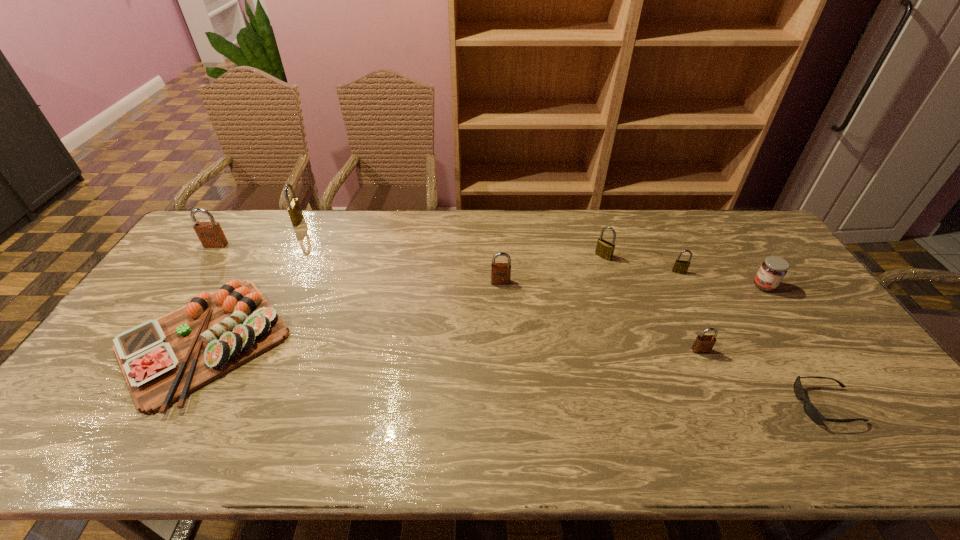
This screenshot has width=960, height=540. Identify the location of the farthest brass padlock. (294, 209).

In order to click on the second padlock from left to right in this screenshot , I will do `click(294, 209)`.

The image size is (960, 540). Identify the location of the farthest brown padlock. (210, 234).

Identify the location of the fifth nearest padlock. This screenshot has height=540, width=960. (210, 234).

In order to click on the third padlock from left to right in this screenshot , I will do `click(500, 272)`.

Identify the location of the fourth object from left to right. Image resolution: width=960 pixels, height=540 pixels. (500, 272).

The image size is (960, 540). Identify the location of the third farthest padlock. (604, 249).

The image size is (960, 540). I want to click on the fifth object from right to left, so click(604, 249).

Find the location of a particular element. red jam is located at coordinates (772, 271).

The image size is (960, 540). What are the coordinates of `the sixth nearest object` in the screenshot? It's located at (681, 267).